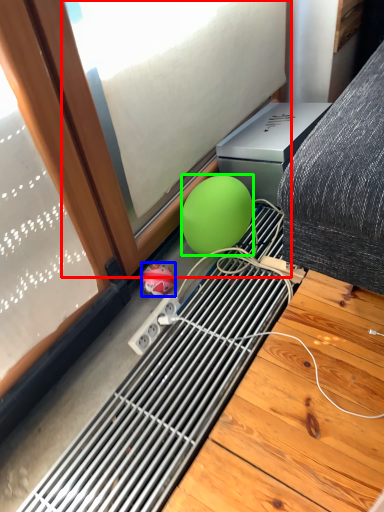
Question: Estimate the real-world distances between objects in this image. Which object is farther from window (highlighted by a red box), ball (highlighted by a blue box) or ball (highlighted by a green box)?

Choices:
 (A) ball
 (B) ball

Answer: (A)